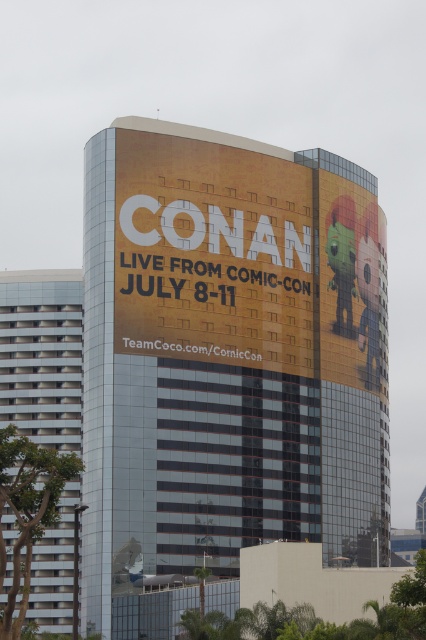
Question: Which object is closer to the camera taking this photo?

Choices:
 (A) white glass windows at left
 (B) yellow matte sign at center

Answer: (A)

Question: Does yellow matte sign at center appear on the left side of white glass windows at left?

Choices:
 (A) yes
 (B) no

Answer: (B)

Question: Considering the relative positions of yellow matte sign at center and white glass windows at left in the image provided, where is yellow matte sign at center located with respect to white glass windows at left?

Choices:
 (A) right
 (B) left

Answer: (A)

Question: Does yellow matte sign at center appear on the right side of white glass windows at left?

Choices:
 (A) yes
 (B) no

Answer: (A)